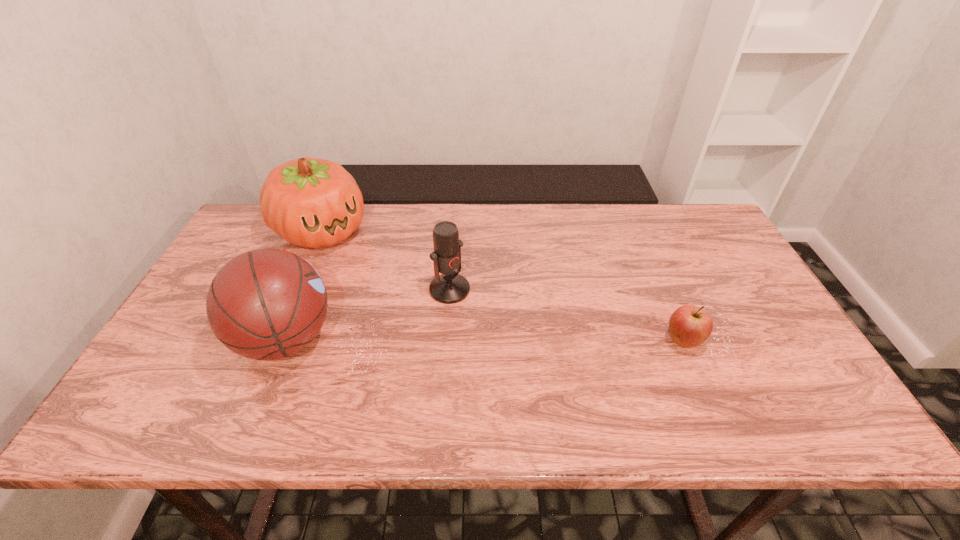
This screenshot has height=540, width=960. I want to click on vacant space located on the side of the farthest object with the cute face, so click(376, 283).

The image size is (960, 540). Find the location of `free point located on the side of the microphone with the red ring`. free point located on the side of the microphone with the red ring is located at coordinates (501, 337).

Image resolution: width=960 pixels, height=540 pixels. What are the coordinates of `free space located 0.360m on the side of the microphone with the red ring` in the screenshot? It's located at (561, 392).

Image resolution: width=960 pixels, height=540 pixels. I want to click on vacant space positioned 0.080m on the side of the microphone with the red ring, so click(x=481, y=318).

I want to click on object that is positioned at the far edge, so click(x=310, y=202).

The height and width of the screenshot is (540, 960). Identify the location of object that is at the near edge. (266, 304).

Identify the location of basketball positioned at the left edge. The width and height of the screenshot is (960, 540). 266,304.

Where is `pumpkin that is at the left edge`? pumpkin that is at the left edge is located at coordinates (310, 202).

Find the location of a particular element. object situated at the far left corner is located at coordinates (310, 202).

Find the location of a particular element. The height and width of the screenshot is (540, 960). object that is at the near left corner is located at coordinates (266, 304).